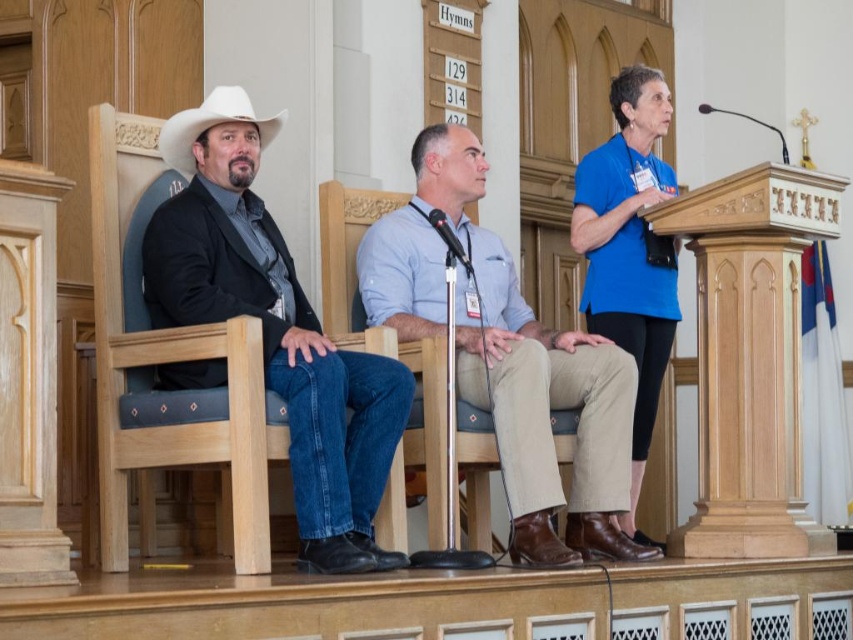
Question: Which object is farther from the camera taking this photo?

Choices:
 (A) blue fabric shirt at upper right
 (B) black plastic microphone at upper right
 (C) black plastic microphone at center

Answer: (B)

Question: From the image, what is the correct spatial relationship of matte black jacket at left in relation to black plastic microphone at upper right?

Choices:
 (A) right
 (B) left

Answer: (B)

Question: Is matte black jacket at left positioned behind blue fabric shirt at upper right?

Choices:
 (A) yes
 (B) no

Answer: (B)

Question: Can you confirm if matte black jacket at left is thinner than black plastic microphone at center?

Choices:
 (A) no
 (B) yes

Answer: (A)

Question: Considering the real-world distances, which object is farthest from the black plastic microphone at upper right?

Choices:
 (A) white matte cowboy hat at left
 (B) matte black jacket at left
 (C) blue fabric shirt at upper right

Answer: (B)

Question: Which object is the closest to the matte black jacket at left?

Choices:
 (A) black plastic microphone at upper right
 (B) light blue cotton shirt at center
 (C) black plastic microphone at center
 (D) blue fabric shirt at upper right

Answer: (C)